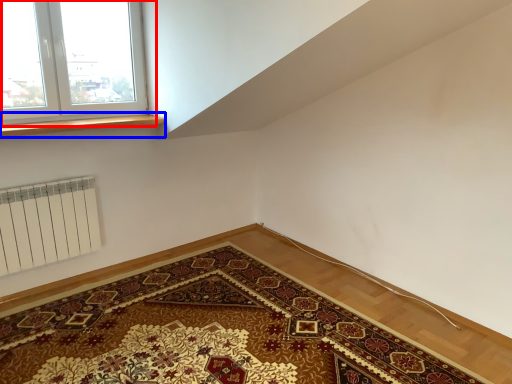
Question: Which of the following is the closest to the observer, window (highlighted by a red box) or window sill (highlighted by a blue box)?

Choices:
 (A) window
 (B) window sill

Answer: (A)